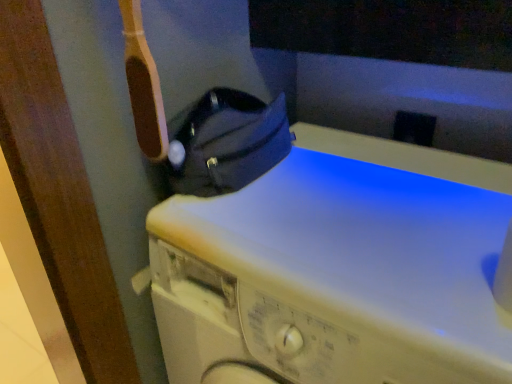
Question: Considering the positions of white matte washing machine at center and black leather bag at upper left in the image, is white matte washing machine at center bigger or smaller than black leather bag at upper left?

Choices:
 (A) big
 (B) small

Answer: (A)

Question: From the image's perspective, is white matte washing machine at center positioned above or below black leather bag at upper left?

Choices:
 (A) below
 (B) above

Answer: (A)

Question: Choose the correct answer: Is white matte washing machine at center inside black leather bag at upper left or outside it?

Choices:
 (A) inside
 (B) outside

Answer: (B)

Question: From the image's perspective, is black leather bag at upper left above or below white matte washing machine at center?

Choices:
 (A) above
 (B) below

Answer: (A)

Question: Considering the positions of black leather bag at upper left and white matte washing machine at center in the image, is black leather bag at upper left bigger or smaller than white matte washing machine at center?

Choices:
 (A) big
 (B) small

Answer: (B)

Question: From a real-world perspective, is black leather bag at upper left positioned above or below white matte washing machine at center?

Choices:
 (A) above
 (B) below

Answer: (A)

Question: Looking at their shapes, would you say black leather bag at upper left is wider or thinner than white matte washing machine at center?

Choices:
 (A) wide
 (B) thin

Answer: (B)